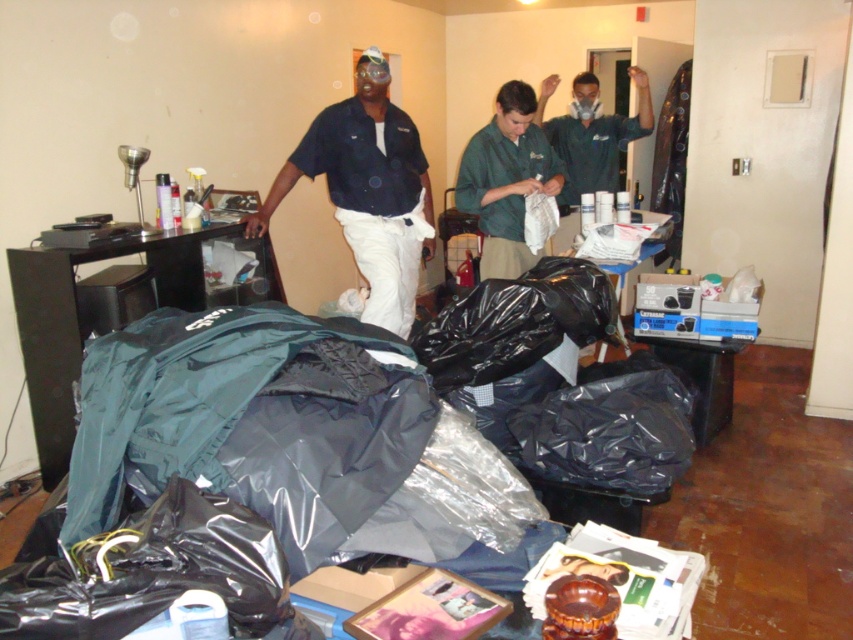
Question: Which point is farther from the camera taking this photo?

Choices:
 (A) (194, 416)
 (B) (352, 451)
 (C) (489, 125)
 (D) (347, 113)

Answer: (C)

Question: Estimate the real-world distances between objects in this image. Which object is farther from the teal matte sleeping bag at lower left?

Choices:
 (A) black plastic bag at center
 (B) green uniform at center

Answer: (B)

Question: Can you confirm if black plastic bag at center is wider than green uniform at center?

Choices:
 (A) yes
 (B) no

Answer: (A)

Question: Which object is closer to the camera taking this photo?

Choices:
 (A) matte black shirt at center
 (B) green uniform at center
 (C) black plastic bag at center

Answer: (C)

Question: Observing the image, what is the correct spatial positioning of teal matte sleeping bag at lower left in reference to green uniform at center?

Choices:
 (A) below
 (B) above

Answer: (A)

Question: Where is black plastic bag at center located in relation to green uniform at center in the image?

Choices:
 (A) left
 (B) right

Answer: (A)